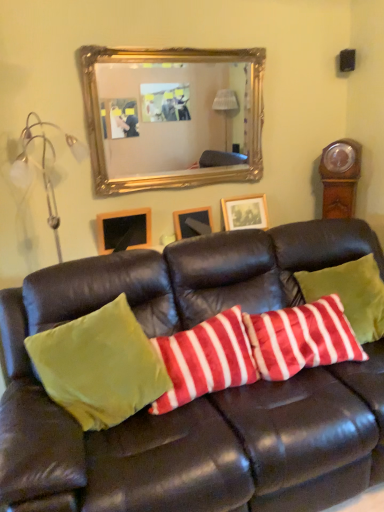
Question: From the image's perspective, is metallic silver lamp at left above or below velvet green couch at center?

Choices:
 (A) below
 (B) above

Answer: (B)

Question: From a real-world perspective, is metallic silver lamp at left above or below velvet green couch at center?

Choices:
 (A) below
 (B) above

Answer: (B)

Question: Which object is positioned closest to the wooden picture frame at center, the 2th picture frame when ordered from right to left?

Choices:
 (A) wooden picture frame at upper left, the 1th picture frame from the left
 (B) gold/gilded mirror at upper center
 (C) metallic silver lamp at left
 (D) wooden grandfather clock at right
 (E) matte white picture frame at center, acting as the 3th picture frame starting from the left

Answer: (E)

Question: Which object is the closest to the velvety red and white striped pillow at center, positioned as the second pillow in right-to-left order?

Choices:
 (A) wooden picture frame at center, the 2th picture frame when ordered from right to left
 (B) metallic silver lamp at left
 (C) green velvet pillow at center, which ranks as the first pillow in left-to-right order
 (D) velvety red and white striped pillow at center, the third pillow when ordered from left to right
 (E) gold/gilded mirror at upper center

Answer: (C)